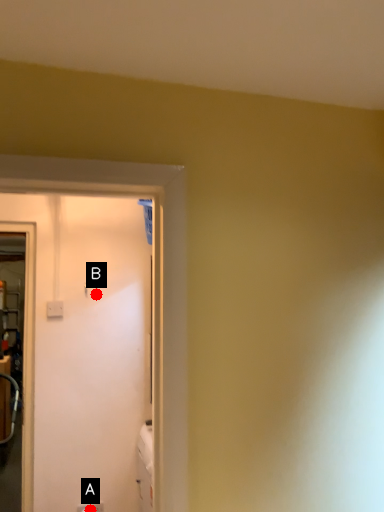
Question: Two points are circled on the image, labeled by A and B beside each circle. Which point is farther from the camera taking this photo?

Choices:
 (A) A is further
 (B) B is further

Answer: (B)